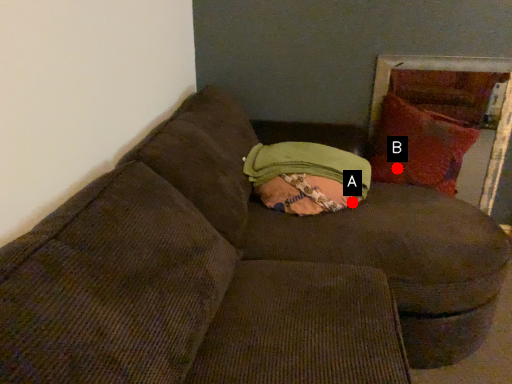
Question: Two points are circled on the image, labeled by A and B beside each circle. Among these points, which one is nearest to the camera?

Choices:
 (A) A is closer
 (B) B is closer

Answer: (A)